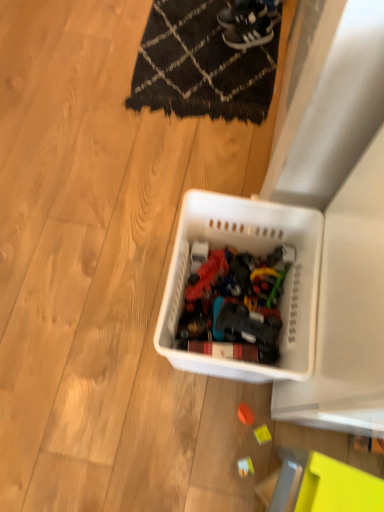
Image resolution: width=384 pixels, height=512 pixels. Find the location of `free spot behind black suede sneakers at upper center, placed as the second footwear when sorted from bottom to top`. free spot behind black suede sneakers at upper center, placed as the second footwear when sorted from bottom to top is located at coordinates tap(235, 5).